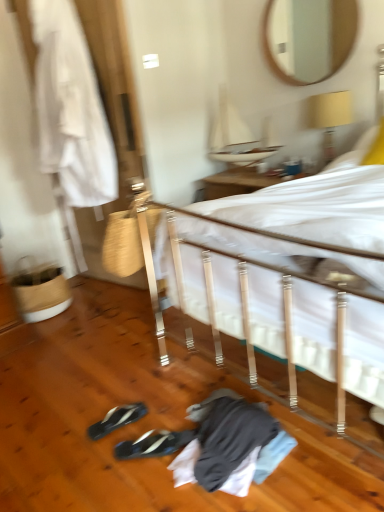
Question: In terms of width, does black synthetic sneakers at lower left, the second footwear viewed from the front, look wider or thinner when compared to white fabric at left?

Choices:
 (A) thin
 (B) wide

Answer: (A)

Question: From their relative heights in the image, would you say black synthetic sneakers at lower left, the second footwear viewed from the front, is taller or shorter than white fabric at left?

Choices:
 (A) tall
 (B) short

Answer: (B)

Question: Which is nearer to the wooden mirror at upper center?

Choices:
 (A) black synthetic sneakers at lower center, the second footwear in the back-to-front sequence
 (B) white fabric bed at center
 (C) white fabric at left
 (D) black synthetic sneakers at lower left, the second footwear viewed from the front
 (E) yellow fabric lampshade at upper right

Answer: (E)

Question: Which of these objects is positioned closest to the black synthetic sneakers at lower center, arranged as the 1th footwear when viewed from the front?

Choices:
 (A) black synthetic sneakers at lower left, which appears as the 1th footwear when viewed from the back
 (B) wooden mirror at upper center
 (C) white fabric bed at center
 (D) white fabric at left
 (E) yellow fabric lampshade at upper right

Answer: (A)